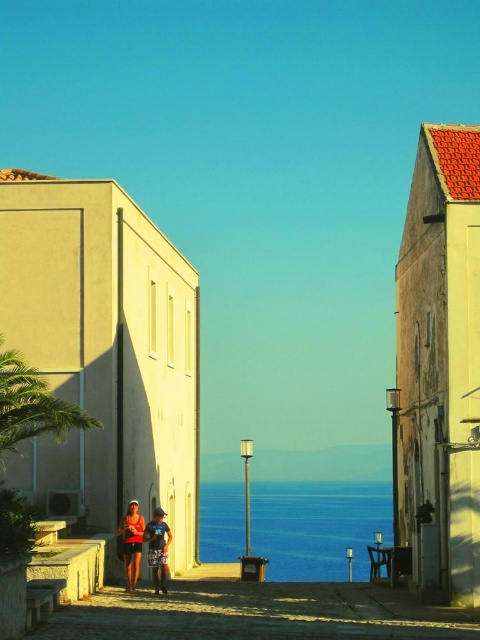
Describe the element at coordinates (317, 525) in the screenshot. I see `blue water at center` at that location.

Does blue water at center have a lesser width compared to matte orange tank top at center?

No, blue water at center is not thinner than matte orange tank top at center.

The height and width of the screenshot is (640, 480). Identify the location of blue water at center. (317, 525).

Identify the location of blue water at center. (317, 525).

Can you confirm if matte orange shorts at center is wider than blue denim shorts at center?

Yes.

Can you confirm if matte orange shorts at center is bigger than blue denim shorts at center?

Correct, matte orange shorts at center is larger in size than blue denim shorts at center.

Find the location of a particular element. Image resolution: width=480 pixels, height=640 pixels. matte orange shorts at center is located at coordinates (147, 545).

Who is positioned more to the left, blue water at center or blue denim shorts at center?

blue denim shorts at center is more to the left.

Which of these two, blue water at center or blue denim shorts at center, stands shorter?

blue denim shorts at center

Is point (367, 566) in front of point (164, 552)?

No, (367, 566) is further to viewer.

This screenshot has width=480, height=640. I want to click on blue water at center, so click(317, 525).